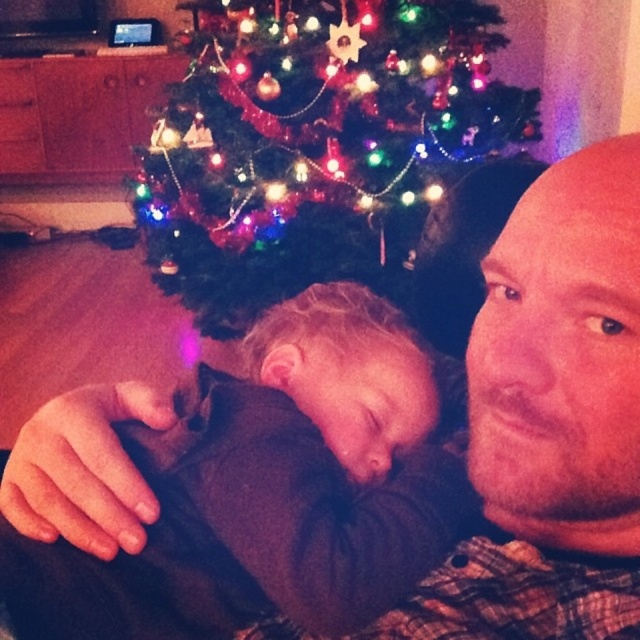
You are a photographer standing 20 inches away from the camera. You want to take a photo of the soft brown sweater at center. Can you adjust your position to ensure the sweater is in focus without moving the camera?

The soft brown sweater at center and camera are 20.35 inches apart from each other. Since you are standing 20 inches away from the camera, you are already within the required distance to focus on the sweater without needing to move closer or farther away.

You are a photographer standing in the room and want to take a photo of the soft brown sweater at center and the green matte christmas tree at upper center. Which object should you focus on first if you want to ensure both are in the frame without moving the camera?

You should focus on the green matte christmas tree at upper center first because the soft brown sweater at center is located below it, ensuring both will be captured in the frame.